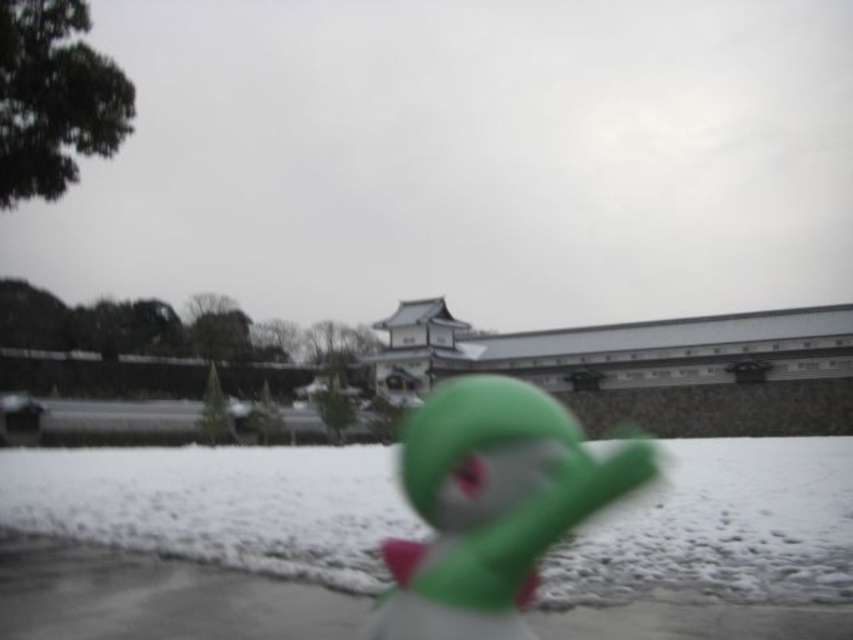
Question: Does white fluffy snow at center have a lesser width compared to green rubber duck at center?

Choices:
 (A) yes
 (B) no

Answer: (B)

Question: Which object is farther from the camera taking this photo?

Choices:
 (A) green rubber duck at center
 (B) white fluffy snow at center

Answer: (B)

Question: Among these objects, which one is nearest to the camera?

Choices:
 (A) white fluffy snow at center
 (B) green rubber duck at center

Answer: (B)

Question: Among these points, which one is farthest from the camera?

Choices:
 (A) (257, 609)
 (B) (460, 547)

Answer: (A)

Question: In this image, where is white fluffy snow at center located relative to green rubber duck at center?

Choices:
 (A) below
 (B) above

Answer: (A)

Question: Is white fluffy snow at center smaller than green rubber duck at center?

Choices:
 (A) yes
 (B) no

Answer: (B)